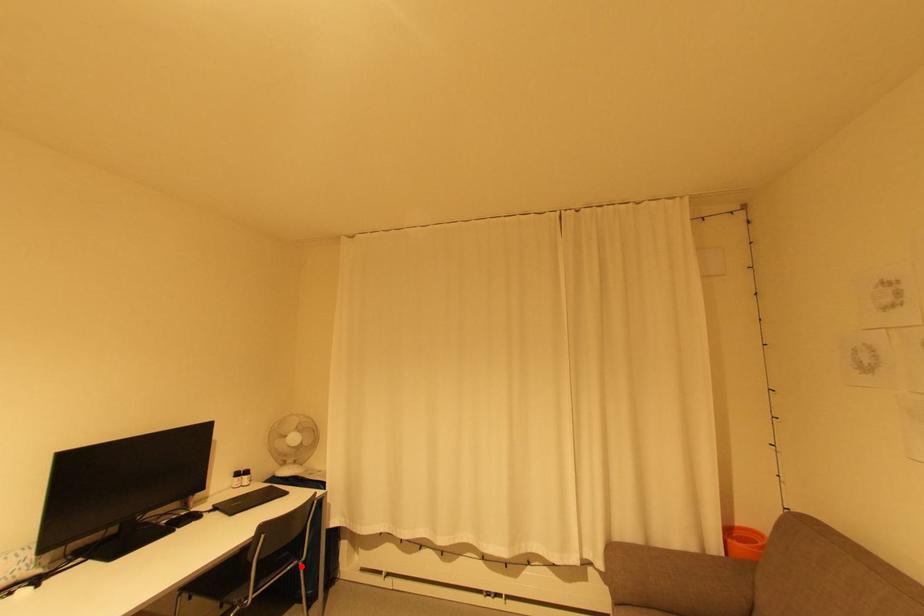
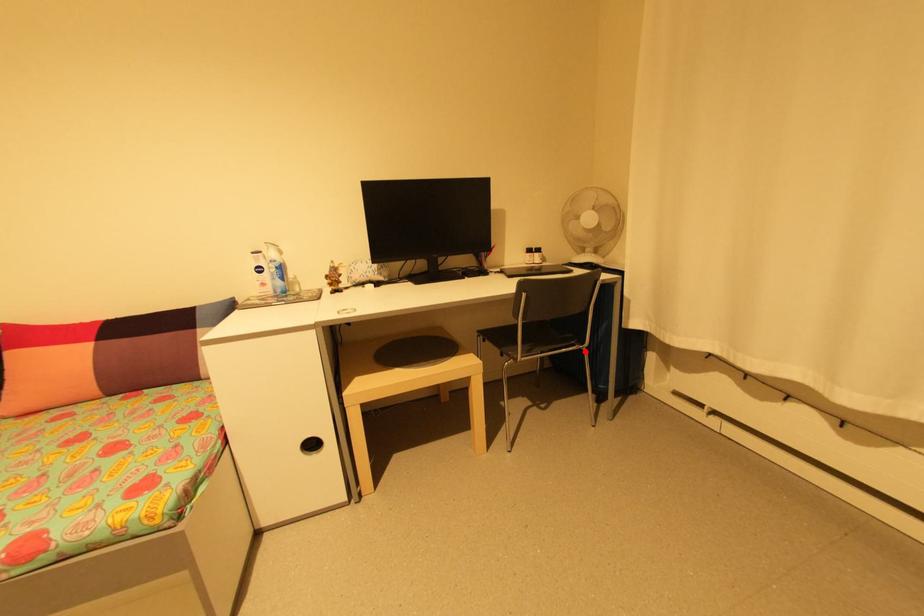
In the scene shown: I am providing you with two images of the same scene from different viewpoints. A red point is marked on the first image and another point is marked on the second image. Are the points marked in image1 and image2 representing the same 3D position?

Yes